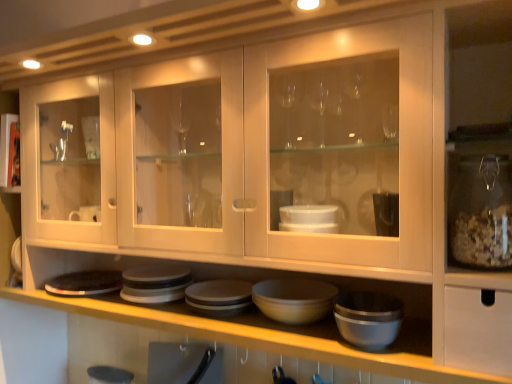
Question: Based on their positions, is matte gray bowl at center located to the left or right of matte gray platter at lower center?

Choices:
 (A) right
 (B) left

Answer: (A)

Question: Considering the positions of matte gray bowl at center and matte gray platter at lower center in the image, is matte gray bowl at center bigger or smaller than matte gray platter at lower center?

Choices:
 (A) big
 (B) small

Answer: (A)

Question: Is point (312, 306) closer or farther from the camera than point (101, 286)?

Choices:
 (A) closer
 (B) farther

Answer: (A)

Question: Is matte gray platter at lower center wider or thinner than matte gray bowl at center?

Choices:
 (A) thin
 (B) wide

Answer: (B)

Question: In the image, is matte gray platter at lower center on the left side or the right side of matte gray bowl at center?

Choices:
 (A) left
 (B) right

Answer: (A)

Question: Is matte gray platter at lower center in front of or behind matte gray bowl at center in the image?

Choices:
 (A) front
 (B) behind

Answer: (B)

Question: Does point (111, 286) appear closer or farther from the camera than point (264, 306)?

Choices:
 (A) farther
 (B) closer

Answer: (A)